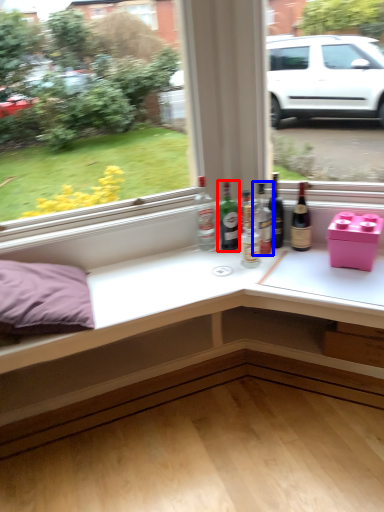
Question: Which object appears closest to the camera in this image, bottle (highlighted by a red box) or bottle (highlighted by a blue box)?

Choices:
 (A) bottle
 (B) bottle

Answer: (B)